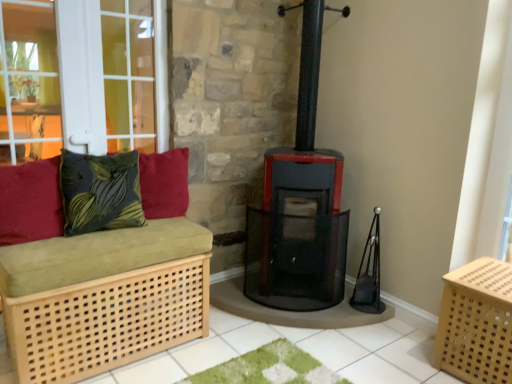
Question: Can you confirm if green leafy fabric cushion at left, positioned as the 2th pillow in left-to-right order, is positioned to the left of velvety red cushion at upper left, which ranks as the third pillow in left-to-right order?

Choices:
 (A) no
 (B) yes

Answer: (B)

Question: Is green leafy fabric cushion at left, positioned as the 2th pillow in left-to-right order, positioned far away from velvety red cushion at upper left, positioned as the first pillow in right-to-left order?

Choices:
 (A) yes
 (B) no

Answer: (B)

Question: From a real-world perspective, is green leafy fabric cushion at left, the 2th pillow when ordered from right to left, physically above velvety red cushion at upper left, which ranks as the third pillow in left-to-right order?

Choices:
 (A) yes
 (B) no

Answer: (A)

Question: Is green leafy fabric cushion at left, the 2th pillow when ordered from right to left, facing towards velvety red cushion at upper left, positioned as the first pillow in right-to-left order?

Choices:
 (A) no
 (B) yes

Answer: (A)

Question: From a real-world perspective, does green leafy fabric cushion at left, positioned as the 2th pillow in left-to-right order, sit lower than velvety red cushion at upper left, which ranks as the third pillow in left-to-right order?

Choices:
 (A) no
 (B) yes

Answer: (A)

Question: Is light wood/light brown bench at left spatially inside green leafy fabric cushion at left, positioned as the 2th pillow in left-to-right order, or outside of it?

Choices:
 (A) inside
 (B) outside

Answer: (B)

Question: In terms of size, does light wood/light brown bench at left appear bigger or smaller than green leafy fabric cushion at left, the 2th pillow when ordered from right to left?

Choices:
 (A) big
 (B) small

Answer: (A)

Question: In the image, is light wood/light brown bench at left positioned in front of or behind green leafy fabric cushion at left, the 2th pillow when ordered from right to left?

Choices:
 (A) behind
 (B) front

Answer: (B)

Question: Looking at their shapes, would you say light wood/light brown bench at left is wider or thinner than green leafy fabric cushion at left, positioned as the 2th pillow in left-to-right order?

Choices:
 (A) thin
 (B) wide

Answer: (B)

Question: Is green leafy fabric cushion at left, positioned as the 2th pillow in left-to-right order, to the left or to the right of light wood/canvassed crate at lower right in the image?

Choices:
 (A) left
 (B) right

Answer: (A)

Question: Is green leafy fabric cushion at left, the 2th pillow when ordered from right to left, situated inside light wood/canvassed crate at lower right or outside?

Choices:
 (A) inside
 (B) outside

Answer: (B)

Question: Considering the positions of green leafy fabric cushion at left, the 2th pillow when ordered from right to left, and light wood/canvassed crate at lower right in the image, is green leafy fabric cushion at left, the 2th pillow when ordered from right to left, wider or thinner than light wood/canvassed crate at lower right?

Choices:
 (A) thin
 (B) wide

Answer: (A)

Question: Considering their positions, is green leafy fabric cushion at left, positioned as the 2th pillow in left-to-right order, located in front of or behind light wood/canvassed crate at lower right?

Choices:
 (A) front
 (B) behind

Answer: (B)

Question: Visually, is light wood/canvassed crate at lower right positioned to the left or to the right of green leafy fabric cushion at left, positioned as the 2th pillow in left-to-right order?

Choices:
 (A) right
 (B) left

Answer: (A)

Question: From a real-world perspective, relative to green leafy fabric cushion at left, positioned as the 2th pillow in left-to-right order, is light wood/canvassed crate at lower right vertically above or below?

Choices:
 (A) below
 (B) above

Answer: (A)